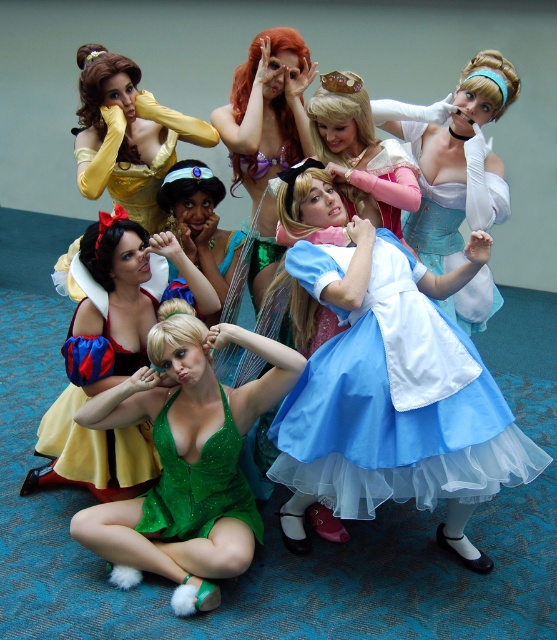
Question: Can you confirm if blue satin dress at center is bigger than shiny purple dress at center?

Choices:
 (A) yes
 (B) no

Answer: (A)

Question: Which point is farther to the camera?

Choices:
 (A) (102, 161)
 (B) (393, 188)
 (C) (134, 440)

Answer: (A)

Question: Which is nearer to the green sequined dress at center?

Choices:
 (A) light blue satin dress at center
 (B) pastel blue dress at center
 (C) blue satin dress at center

Answer: (C)

Question: Which of these objects is positioned closest to the matte yellow dress at upper left?

Choices:
 (A) blue satin dress at center
 (B) pastel blue dress at center
 (C) light blue satin dress at center

Answer: (B)

Question: Is blue satin dress at center smaller than shiny purple dress at center?

Choices:
 (A) yes
 (B) no

Answer: (B)

Question: Is green sparkly dress at center below green satin dress at lower center?

Choices:
 (A) yes
 (B) no

Answer: (A)